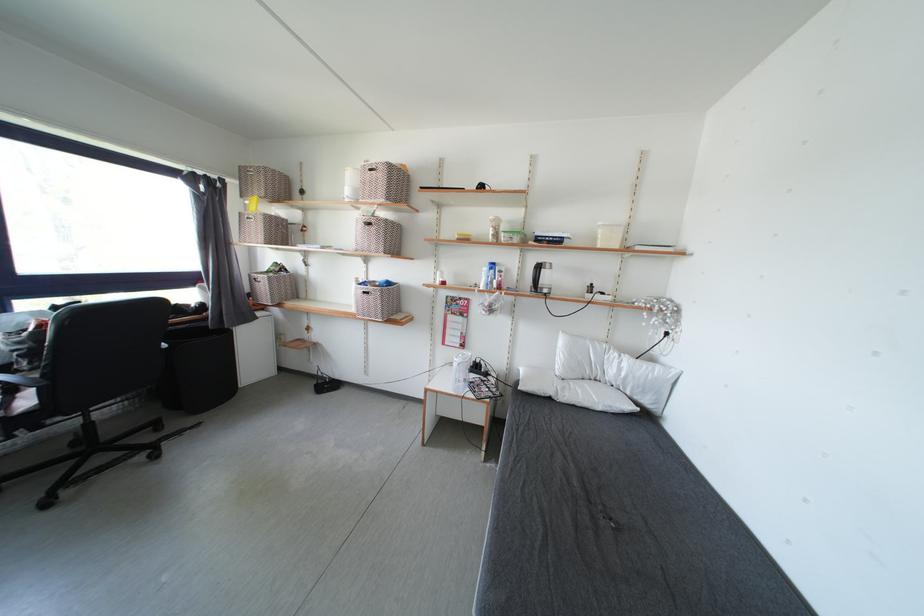
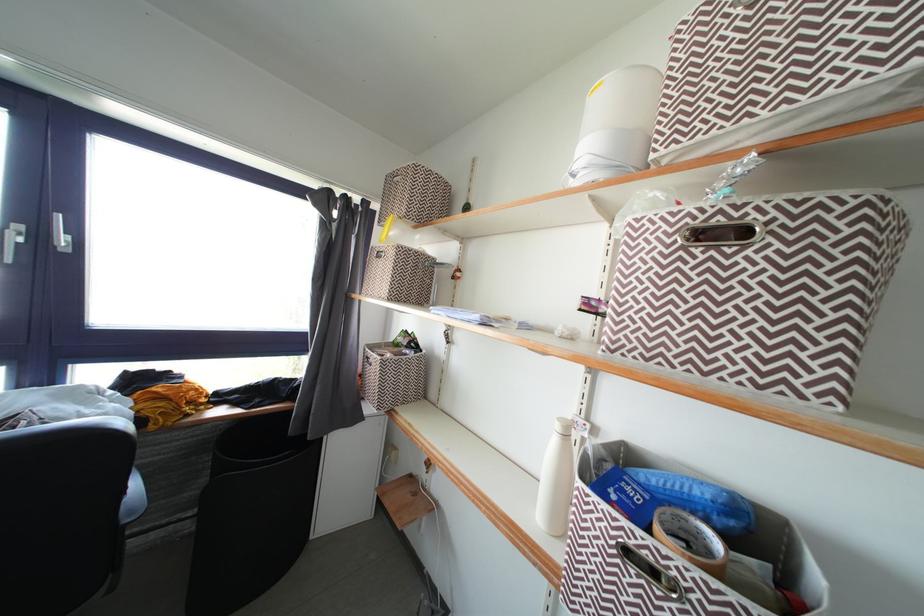
In the second image, find the point that corresponds to pixel 275 283 in the first image.

(390, 367)